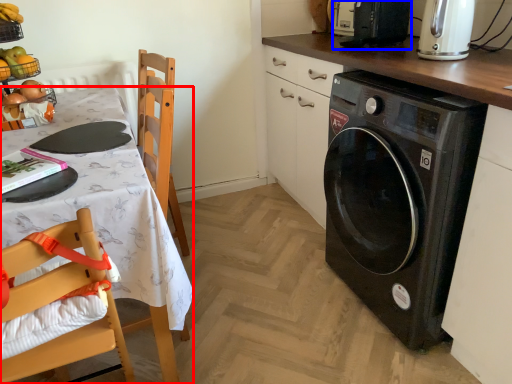
Question: Which point is closer to the camera, desk (highlighted by a red box) or appliance (highlighted by a blue box)?

Choices:
 (A) desk
 (B) appliance

Answer: (A)